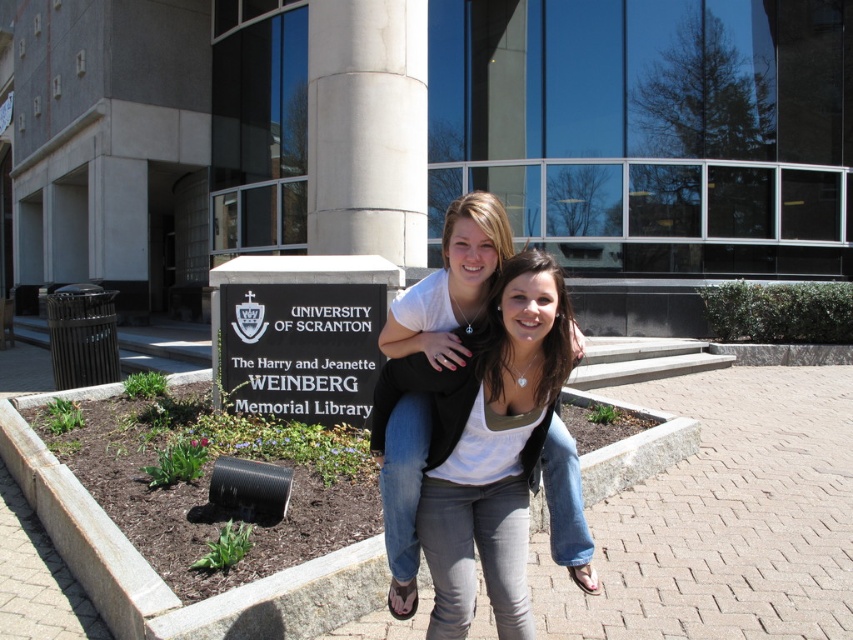
Looking at this image, is white concrete pillar at center wider than black plastic sign at center?

Correct, the width of white concrete pillar at center exceeds that of black plastic sign at center.

Can you confirm if white concrete pillar at center is bigger than black plastic sign at center?

Yes, white concrete pillar at center is bigger than black plastic sign at center.

Who is more distant from viewer, (x=338, y=49) or (x=229, y=406)?

The point (x=338, y=49) is more distant.

Where is `white concrete pillar at center`? The height and width of the screenshot is (640, 853). white concrete pillar at center is located at coordinates (367, 129).

Does white matte shirt at center appear over black plastic sign at center?

No.

Does white matte shirt at center appear under black plastic sign at center?

Correct, white matte shirt at center is located below black plastic sign at center.

Which is in front, point (502, 276) or point (341, 412)?

Point (502, 276) is in front.

In order to click on white matte shirt at center in this screenshot , I will do `click(490, 429)`.

Can you confirm if white matte shirt at center is positioned to the left of white concrete pillar at center?

In fact, white matte shirt at center is to the right of white concrete pillar at center.

Does white matte shirt at center have a greater width compared to white concrete pillar at center?

Incorrect, white matte shirt at center's width does not surpass white concrete pillar at center's.

Who is more distant from viewer, (519, 488) or (363, 3)?

Positioned behind is point (363, 3).

At what (x,y) coordinates should I click in order to perform the action: click on white matte shirt at center. Please return your answer as a coordinate pair (x, y). The height and width of the screenshot is (640, 853). Looking at the image, I should click on pyautogui.click(x=490, y=429).